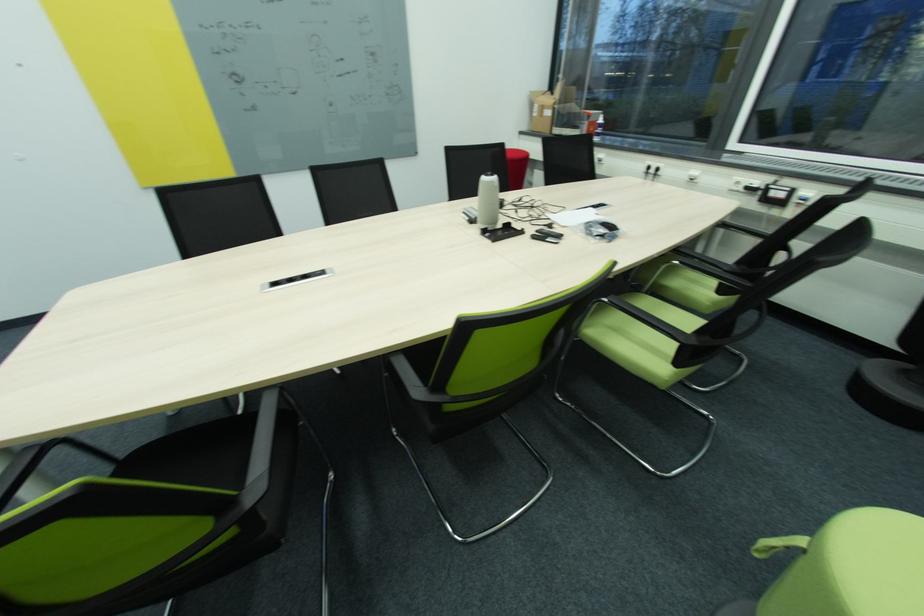
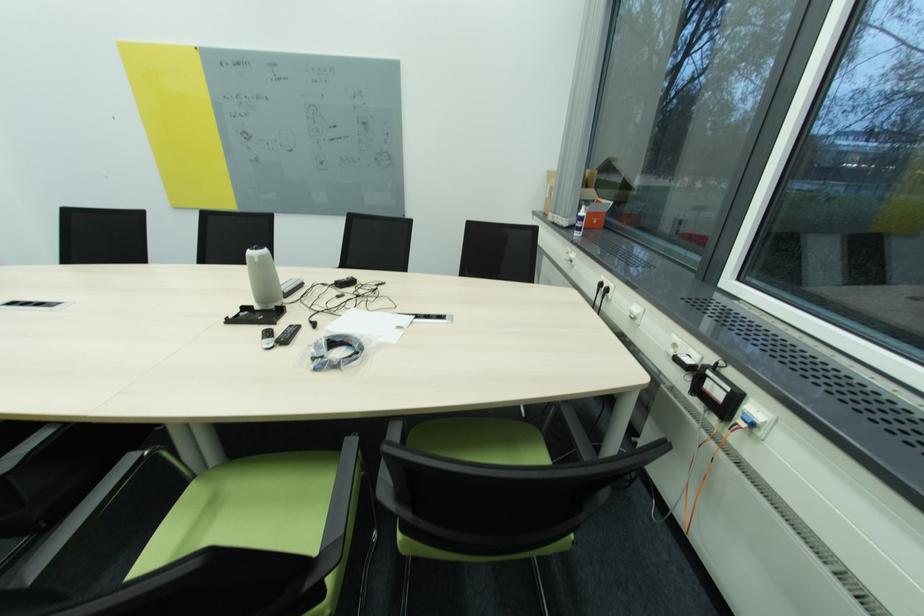
The images are taken continuously from a first-person perspective. In which direction are you moving?

The cameraman walked toward right, forward.